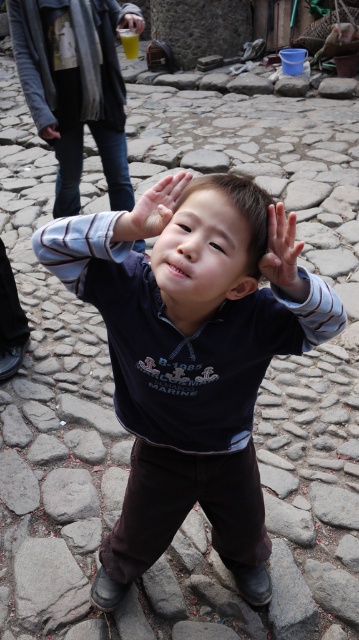
In the scene shown: You are a photographer holding a camera and want to take a picture of the dark blue fleece at center. If you are currently 1.05 meters away from the fleece, is this distance suitable for capturing the entire fleece in the frame?

The dark blue fleece at center and camera are 1.05 meters apart from each other. This distance may be suitable depending on the camera lens used. A standard lens might require being closer, while a wide angle could capture it from this distance.

You are a photographer trying to capture the child in the image. You want to ensure the yellow plastic cup at upper center and the dark gray leather hand at center are both visible in your shot. Based on their positions, which object is higher in the frame?

The yellow plastic cup at upper center is above the dark gray leather hand at center, so the yellow plastic cup at upper center is higher in the frame.